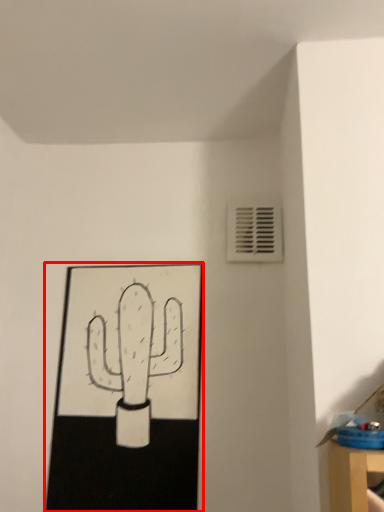
Question: From the image's perspective, considering the relative positions of picture frame (annotated by the red box) and air conditioning in the image provided, where is picture frame (annotated by the red box) located with respect to the staircase?

Choices:
 (A) above
 (B) below

Answer: (B)